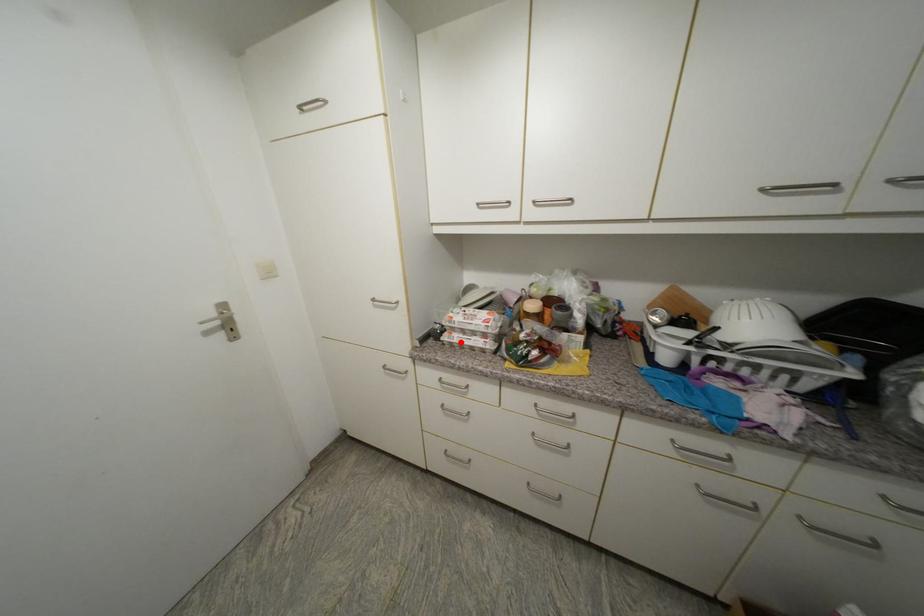
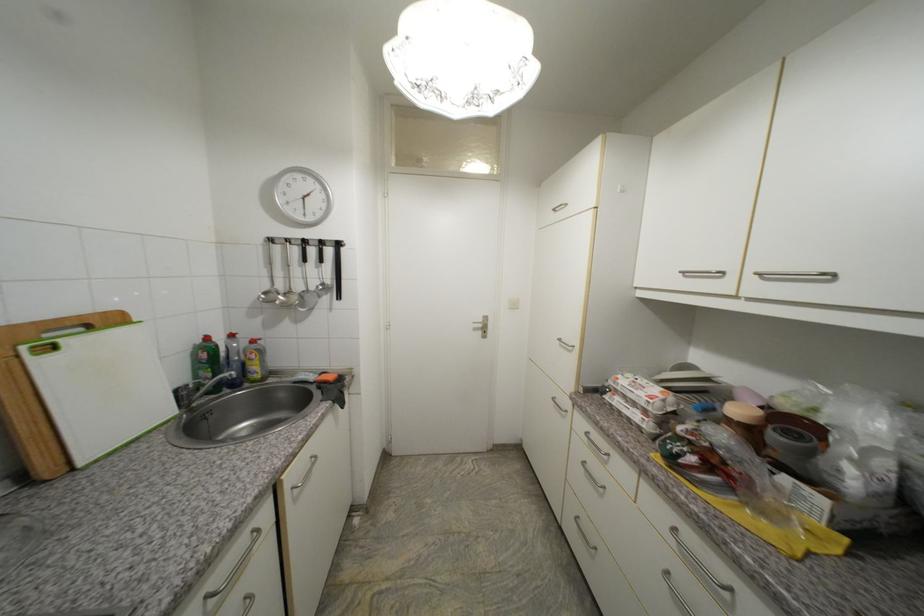
The point at the highlighted location is marked in the first image. Where is the corresponding point in the second image?

(619, 405)